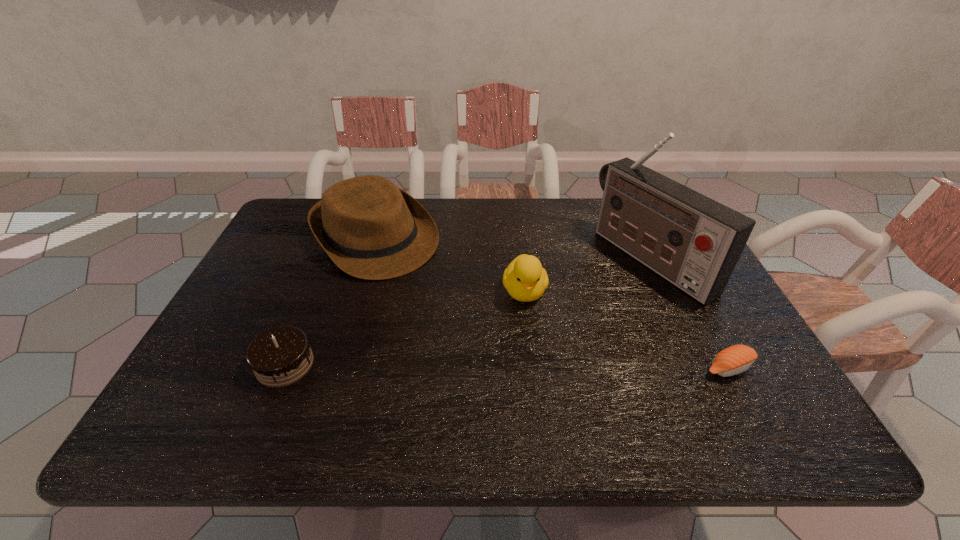
Find the location of a particular element. The height and width of the screenshot is (540, 960). free region at the right edge of the desktop is located at coordinates (695, 300).

The height and width of the screenshot is (540, 960). What are the coordinates of `free space at the far left corner of the desktop` in the screenshot? It's located at click(300, 202).

The image size is (960, 540). I want to click on blank space at the near left corner of the desktop, so [216, 384].

Where is `free location at the near right corner of the desktop`? Image resolution: width=960 pixels, height=540 pixels. free location at the near right corner of the desktop is located at coordinates (723, 396).

You are a GUI agent. You are given a task and a screenshot of the screen. Output one action in this format:
    pyautogui.click(x=<x>, y=<y>)
    Task: Click on the empty space between the sushi and the duck
    The image size is (960, 540).
    Given the screenshot: What is the action you would take?
    pyautogui.click(x=626, y=330)

Locate an element on the screen. Image resolution: width=960 pixels, height=540 pixels. blank region between the chocolate cake and the fedora is located at coordinates (330, 301).

You are a GUI agent. You are given a task and a screenshot of the screen. Output one action in this format:
    pyautogui.click(x=<x>, y=<y>)
    Task: Click on the free spot between the shortest object and the fedora
    The width and height of the screenshot is (960, 540).
    Given the screenshot: What is the action you would take?
    pyautogui.click(x=552, y=303)

Find the location of a particular element. This screenshot has width=960, height=540. free point between the shortest object and the tallest object is located at coordinates (689, 313).

The width and height of the screenshot is (960, 540). Identify the location of unoccupied area between the shortest object and the radio receiver. (689, 313).

This screenshot has height=540, width=960. Identify the location of vacant space in between the fourth tallest object and the third object from right to left. (405, 328).